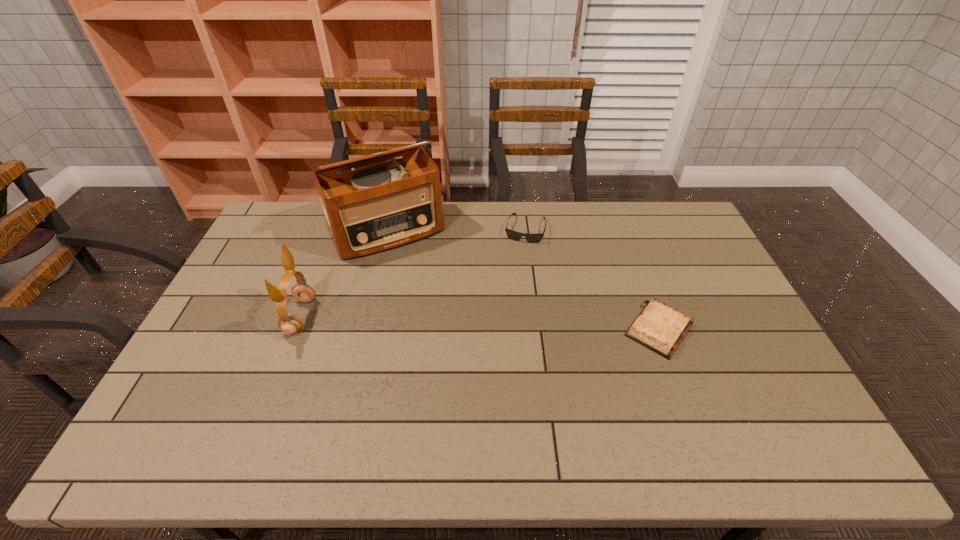
Locate an element on the screen. The image size is (960, 540). vacant space at the right edge of the desktop is located at coordinates (685, 288).

Find the location of a particular element. The height and width of the screenshot is (540, 960). free point at the far left corner is located at coordinates (311, 203).

Find the location of `vacant area at the far right corner`. vacant area at the far right corner is located at coordinates (683, 238).

Where is `free spot between the diary and the radio receiver`? This screenshot has width=960, height=540. free spot between the diary and the radio receiver is located at coordinates (523, 280).

What are the coordinates of `vacant space that is in between the third object from left to right and the radio receiver` in the screenshot? It's located at (456, 230).

I want to click on free spot between the diary and the sunglasses, so click(592, 279).

You are a GUI agent. You are given a task and a screenshot of the screen. Output one action in this format:
    pyautogui.click(x=<x>, y=<y>)
    Task: Click on the vacant space that's between the second shortest object and the second tallest object
    This screenshot has height=540, width=960.
    Given the screenshot: What is the action you would take?
    pyautogui.click(x=413, y=273)

In order to click on vacant space that's between the shortest object and the earphone in this screenshot , I will do `click(480, 323)`.

Where is `unoccupied position between the rightmost object and the sunglasses`? The height and width of the screenshot is (540, 960). unoccupied position between the rightmost object and the sunglasses is located at coordinates (592, 279).

Find the location of `vacant area between the second shortest object and the shortest object`. vacant area between the second shortest object and the shortest object is located at coordinates (592, 279).